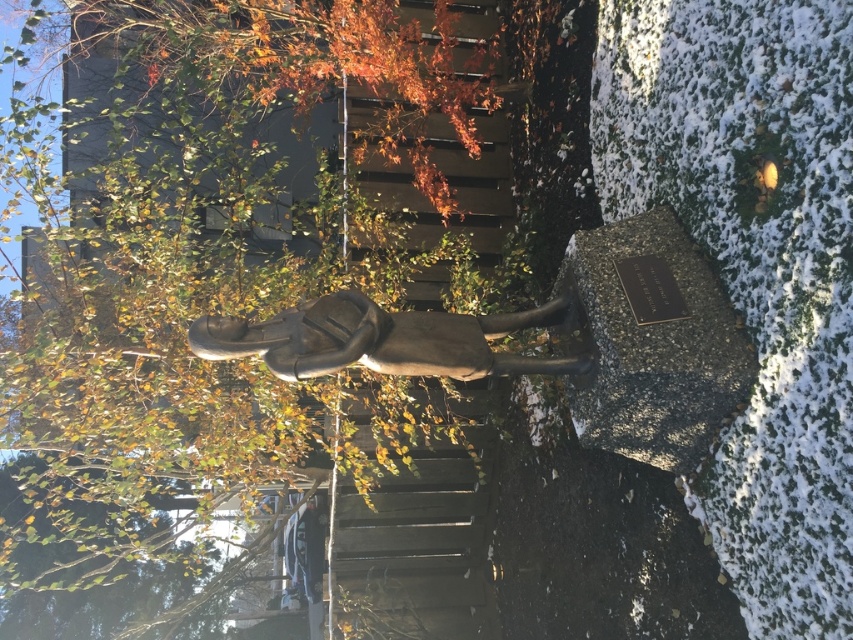
Question: Which point appears farthest from the camera in this image?

Choices:
 (A) (271, 321)
 (B) (368, 616)
 (C) (401, 256)

Answer: (B)

Question: Considering the real-world distances, which object is farthest from the metallic stairwell at center?

Choices:
 (A) bronze statue at center
 (B) green leafy tree at upper left

Answer: (A)

Question: Is green leafy tree at upper left below bronze statue at center?

Choices:
 (A) no
 (B) yes

Answer: (A)

Question: Which of the following is the closest to the observer?

Choices:
 (A) click(x=432, y=637)
 (B) click(x=270, y=324)
 (C) click(x=86, y=445)

Answer: (B)

Question: Is green leafy tree at upper left below bronze statue at center?

Choices:
 (A) yes
 (B) no

Answer: (B)

Question: Where is green leafy tree at upper left located in relation to metallic stairwell at center in the image?

Choices:
 (A) left
 (B) right

Answer: (A)